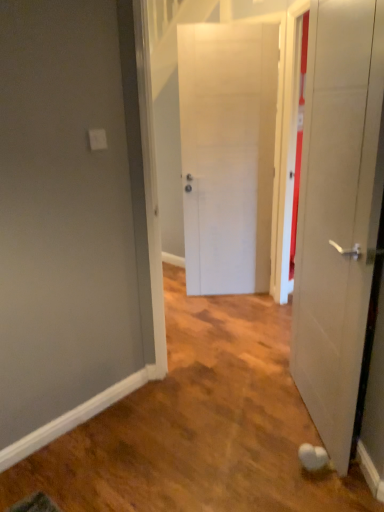
This screenshot has width=384, height=512. What do you see at coordinates (227, 153) in the screenshot? I see `white matte door at center, the second door viewed from the front` at bounding box center [227, 153].

At what (x,y) coordinates should I click in order to perform the action: click on white matte door at center, the 1th door positioned from the back. Please return your answer as a coordinate pair (x, y). The image size is (384, 512). Looking at the image, I should click on click(x=227, y=153).

Measure the distance between white matte door at center, the second door viewed from the front, and camera.

A distance of 9.47 feet exists between white matte door at center, the second door viewed from the front, and camera.

The image size is (384, 512). What do you see at coordinates (338, 213) in the screenshot? I see `white matte door at right, marked as the first door in a front-to-back arrangement` at bounding box center [338, 213].

What is the approximate width of white matte door at right, placed as the second door when sorted from back to front?

6.82 inches.

In order to click on white matte door at right, placed as the second door when sorted from back to front in this screenshot , I will do `click(338, 213)`.

Where is `white matte door at center, the second door viewed from the front`? This screenshot has height=512, width=384. white matte door at center, the second door viewed from the front is located at coordinates (227, 153).

Between white matte door at center, the 1th door positioned from the back, and white matte door at right, placed as the second door when sorted from back to front, which one appears on the right side from the viewer's perspective?

white matte door at right, placed as the second door when sorted from back to front.

Which object is closer to the camera, white matte door at center, the second door viewed from the front, or white matte door at right, marked as the first door in a front-to-back arrangement?

Positioned in front is white matte door at right, marked as the first door in a front-to-back arrangement.

Considering the points (189, 130) and (376, 161), which point is behind, point (189, 130) or point (376, 161)?

The point (189, 130) is behind.

From the image's perspective, does white matte door at center, the second door viewed from the front, appear lower than white matte door at right, placed as the second door when sorted from back to front?

Incorrect, from the image's perspective, white matte door at center, the second door viewed from the front, is higher than white matte door at right, placed as the second door when sorted from back to front.

From a real-world perspective, which is physically below, white matte door at center, the second door viewed from the front, or white matte door at right, placed as the second door when sorted from back to front?

white matte door at right, placed as the second door when sorted from back to front, is physically lower.

Can you confirm if white matte door at center, the 1th door positioned from the back, is wider than white matte door at right, placed as the second door when sorted from back to front?

Incorrect, the width of white matte door at center, the 1th door positioned from the back, does not surpass that of white matte door at right, placed as the second door when sorted from back to front.

Does white matte door at center, the second door viewed from the front, have a lesser height compared to white matte door at right, placed as the second door when sorted from back to front?

Incorrect, the height of white matte door at center, the second door viewed from the front, does not fall short of that of white matte door at right, placed as the second door when sorted from back to front.

Who is smaller, white matte door at center, the second door viewed from the front, or white matte door at right, marked as the first door in a front-to-back arrangement?

white matte door at center, the second door viewed from the front.

Is white matte door at center, the 1th door positioned from the back, not within white matte door at right, placed as the second door when sorted from back to front?

white matte door at center, the 1th door positioned from the back, lies outside white matte door at right, placed as the second door when sorted from back to front,'s area.

Can you see white matte door at center, the 1th door positioned from the back, touching white matte door at right, placed as the second door when sorted from back to front?

white matte door at center, the 1th door positioned from the back, is not next to white matte door at right, placed as the second door when sorted from back to front, and they're not touching.

Is white matte door at center, the 1th door positioned from the back, oriented away from white matte door at right, marked as the first door in a front-to-back arrangement?

No.

How distant is white matte door at center, the second door viewed from the front, from white matte door at right, placed as the second door when sorted from back to front?

The distance of white matte door at center, the second door viewed from the front, from white matte door at right, placed as the second door when sorted from back to front, is 1.36 meters.

Locate an element on the screen. door on the left of the white matte door at right, marked as the first door in a front-to-back arrangement is located at coordinates (227, 153).

Which is more to the left, white matte door at right, marked as the first door in a front-to-back arrangement, or white matte door at center, the second door viewed from the front?

From the viewer's perspective, white matte door at center, the second door viewed from the front, appears more on the left side.

Which object is closer to the camera taking this photo, white matte door at right, marked as the first door in a front-to-back arrangement, or white matte door at center, the 1th door positioned from the back?

white matte door at right, marked as the first door in a front-to-back arrangement, is more forward.

Which point is more distant from viewer, (351, 417) or (192, 202)?

The point (192, 202) is behind.

From the image's perspective, is white matte door at right, marked as the first door in a front-to-back arrangement, located above or below white matte door at center, the second door viewed from the front?

white matte door at right, marked as the first door in a front-to-back arrangement, is situated lower than white matte door at center, the second door viewed from the front, in the image.

From a real-world perspective, is white matte door at right, placed as the second door when sorted from back to front, below white matte door at center, the second door viewed from the front?

Yes, from a real-world perspective, white matte door at right, placed as the second door when sorted from back to front, is below white matte door at center, the second door viewed from the front.

Which of these two, white matte door at right, marked as the first door in a front-to-back arrangement, or white matte door at center, the 1th door positioned from the back, is wider?

white matte door at right, marked as the first door in a front-to-back arrangement, is wider.

Can you confirm if white matte door at right, marked as the first door in a front-to-back arrangement, is shorter than white matte door at center, the 1th door positioned from the back?

Correct, white matte door at right, marked as the first door in a front-to-back arrangement, is not as tall as white matte door at center, the 1th door positioned from the back.

Between white matte door at right, marked as the first door in a front-to-back arrangement, and white matte door at center, the second door viewed from the front, which one has larger size?

Bigger between the two is white matte door at right, marked as the first door in a front-to-back arrangement.

Is white matte door at right, placed as the second door when sorted from back to front, inside the boundaries of white matte door at center, the second door viewed from the front, or outside?

white matte door at right, placed as the second door when sorted from back to front, is outside white matte door at center, the second door viewed from the front.

Is white matte door at right, placed as the second door when sorted from back to front, not near white matte door at center, the 1th door positioned from the back?

That's right, there is a large distance between white matte door at right, placed as the second door when sorted from back to front, and white matte door at center, the 1th door positioned from the back.

Does white matte door at right, placed as the second door when sorted from back to front, turn towards white matte door at center, the 1th door positioned from the back?

No, white matte door at right, placed as the second door when sorted from back to front, is not aimed at white matte door at center, the 1th door positioned from the back.

How different are the orientations of white matte door at right, marked as the first door in a front-to-back arrangement, and white matte door at center, the 1th door positioned from the back, in degrees?

The facing directions of white matte door at right, marked as the first door in a front-to-back arrangement, and white matte door at center, the 1th door positioned from the back, are 89.4 degrees apart.

Locate an element on the screen. door behind the white matte door at right, placed as the second door when sorted from back to front is located at coordinates (227, 153).

At what (x,y) coordinates should I click in order to perform the action: click on door on the left of white matte door at right, placed as the second door when sorted from back to front. Please return your answer as a coordinate pair (x, y). Image resolution: width=384 pixels, height=512 pixels. Looking at the image, I should click on (227, 153).

Locate an element on the screen. The width and height of the screenshot is (384, 512). door behind the white matte door at right, marked as the first door in a front-to-back arrangement is located at coordinates (227, 153).